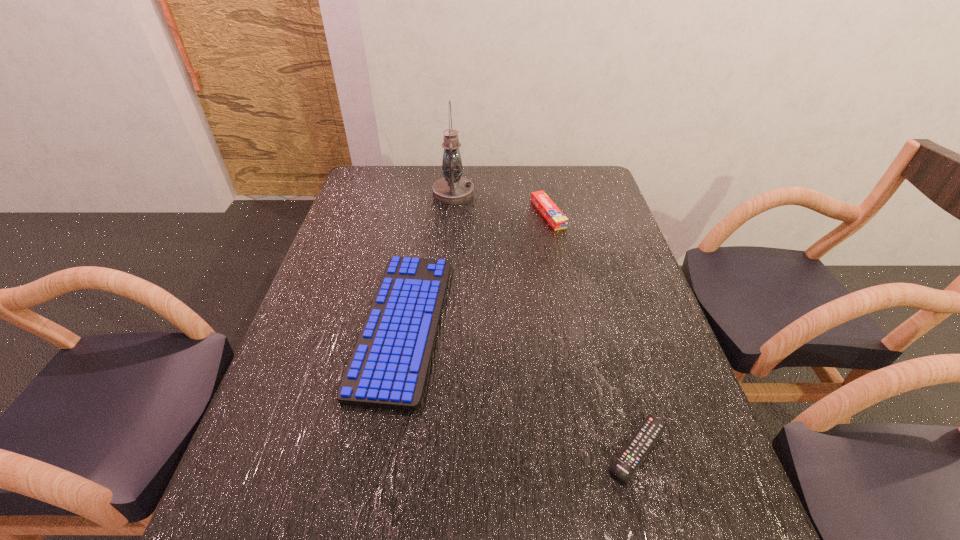
Identify which object is the third nearest to the tallest object. Please provide its 2D coordinates. Your answer should be formatted as a tuple, i.e. [(x, y)], where the tuple contains the x and y coordinates of a point satisfying the conditions above.

[(628, 461)]

Where is `vacant space that satisfies the following two spatial constraints: 1. on the front side of the nearest object; 2. on the left side of the third shortest object`? vacant space that satisfies the following two spatial constraints: 1. on the front side of the nearest object; 2. on the left side of the third shortest object is located at coordinates (596, 449).